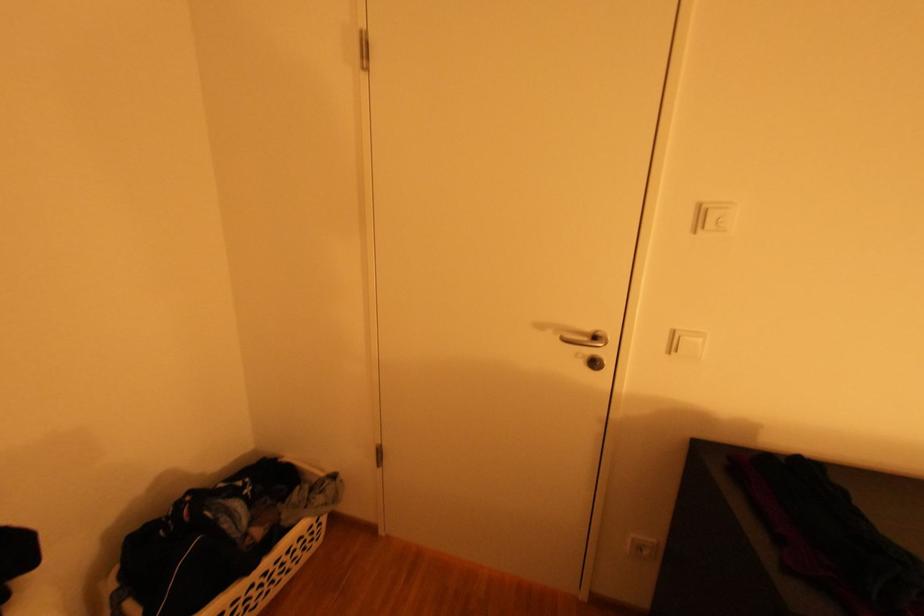
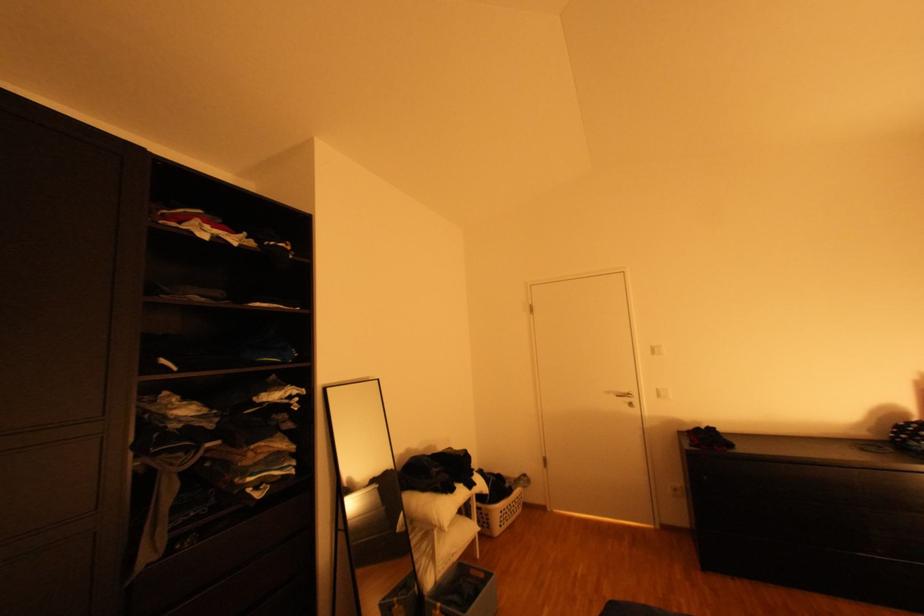
Where in the second image is the point corresponding to (550,328) from the first image?

(617, 392)